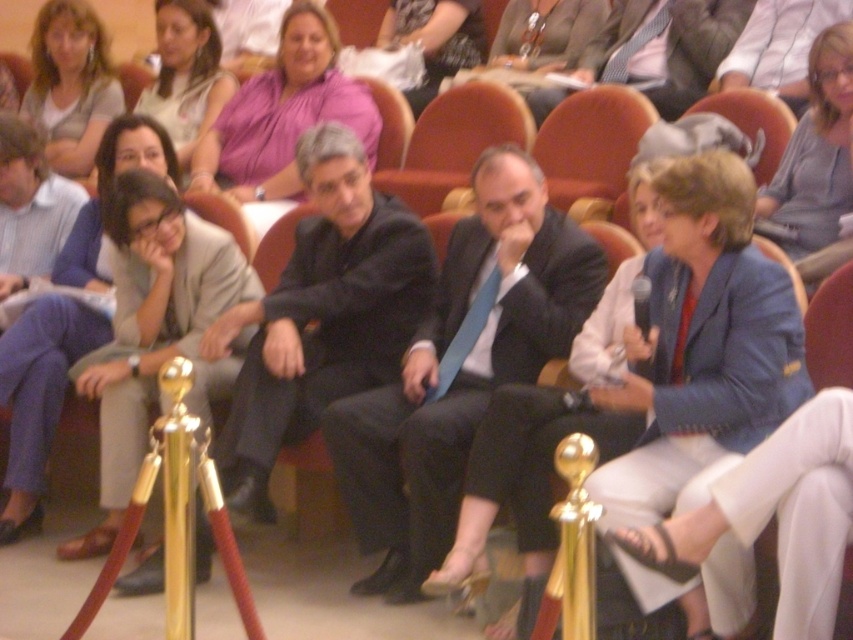
You are standing at the point marked as point (701, 346) in the image. What object are you currently standing on?

You are standing on the blue fabric jacket at center, as the point (701, 346) is located on it.

You are sitting in the first row of the auditorium and notice two people wearing a blue fabric jacket at center and a black suit at center. Which one would you see first if you look straight ahead?

The blue fabric jacket at center is closer to the viewer than the black suit at center, so you would see the blue fabric jacket at center first when looking straight ahead.